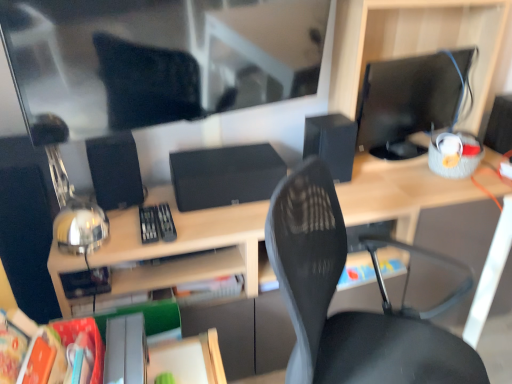
Question: Can you confirm if hardcover book at center, marked as the second paperback book in a front-to-back arrangement, is positioned to the right of black matte speaker at center, which ranks as the second speaker in left-to-right order?

Choices:
 (A) yes
 (B) no

Answer: (B)

Question: Can you confirm if hardcover book at center, the 1th paperback book viewed from the back, is smaller than black matte speaker at center, the second speaker in the right-to-left sequence?

Choices:
 (A) no
 (B) yes

Answer: (B)

Question: From the image's perspective, is hardcover book at center, the 1th paperback book viewed from the back, located above black matte speaker at center, the second speaker in the right-to-left sequence?

Choices:
 (A) no
 (B) yes

Answer: (A)

Question: Considering the relative sizes of hardcover book at center, the first paperback book positioned from the right, and black matte speaker at center, the second speaker in the right-to-left sequence, in the image provided, is hardcover book at center, the first paperback book positioned from the right, wider than black matte speaker at center, the second speaker in the right-to-left sequence,?

Choices:
 (A) no
 (B) yes

Answer: (A)

Question: From a real-world perspective, is hardcover book at center, the first paperback book positioned from the right, located beneath black matte speaker at center, the second speaker in the right-to-left sequence?

Choices:
 (A) no
 (B) yes

Answer: (B)

Question: Is black matte speaker at center, the second speaker in the right-to-left sequence, completely or partially inside hardcover book at center, the 1th paperback book viewed from the back?

Choices:
 (A) yes
 (B) no

Answer: (B)

Question: Is black matte speaker at center, which ranks as the second speaker in left-to-right order, further to the viewer compared to wooden desk at center?

Choices:
 (A) no
 (B) yes

Answer: (B)

Question: Can you confirm if black matte speaker at center, the second speaker in the right-to-left sequence, is wider than wooden desk at center?

Choices:
 (A) yes
 (B) no

Answer: (B)

Question: Does black matte speaker at center, the second speaker in the right-to-left sequence, touch wooden desk at center?

Choices:
 (A) no
 (B) yes

Answer: (A)

Question: Is black matte speaker at center, which ranks as the second speaker in left-to-right order, smaller than wooden desk at center?

Choices:
 (A) yes
 (B) no

Answer: (A)

Question: Is black matte speaker at center, the second speaker in the right-to-left sequence, turned away from wooden desk at center?

Choices:
 (A) no
 (B) yes

Answer: (B)

Question: Is black matte speaker at center, which ranks as the second speaker in left-to-right order, to the left of wooden desk at center from the viewer's perspective?

Choices:
 (A) yes
 (B) no

Answer: (B)

Question: Does black matte speaker at right, positioned as the 3th speaker in left-to-right order, have a smaller size compared to hardcover book at center, the first paperback book positioned from the right?

Choices:
 (A) yes
 (B) no

Answer: (B)